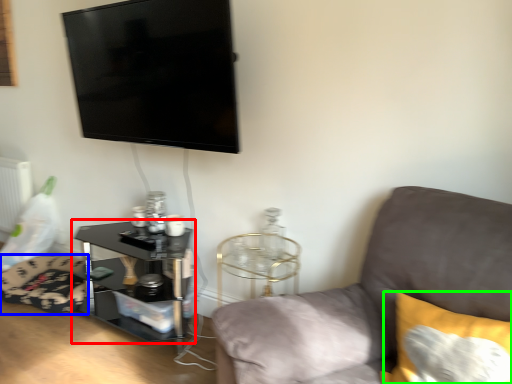
Question: Estimate the real-world distances between objects in this image. Which object is closer to table (highlighted by a red box), swivel chair (highlighted by a blue box) or pillow (highlighted by a green box)?

Choices:
 (A) swivel chair
 (B) pillow

Answer: (A)